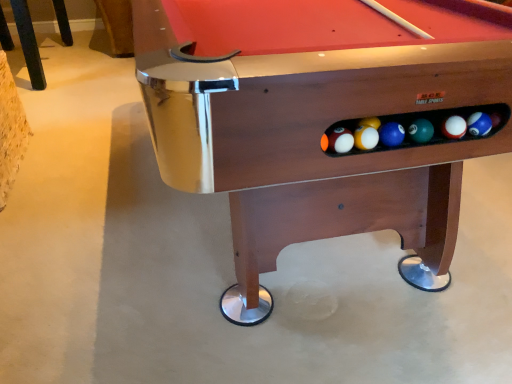
Question: Does wooden chair leg at upper left have a larger size compared to wooden billiard table at center?

Choices:
 (A) yes
 (B) no

Answer: (B)

Question: From the image's perspective, does wooden chair leg at upper left appear lower than wooden billiard table at center?

Choices:
 (A) no
 (B) yes

Answer: (A)

Question: Is wooden chair leg at upper left not inside wooden billiard table at center?

Choices:
 (A) yes
 (B) no

Answer: (A)

Question: Is wooden chair leg at upper left touching wooden billiard table at center?

Choices:
 (A) yes
 (B) no

Answer: (B)

Question: Is wooden chair leg at upper left taller than wooden billiard table at center?

Choices:
 (A) no
 (B) yes

Answer: (A)

Question: From the image's perspective, does wooden chair leg at upper left appear higher than wooden billiard table at center?

Choices:
 (A) no
 (B) yes

Answer: (B)

Question: Is wooden chair leg at upper left at the back of wooden billiard table at center?

Choices:
 (A) no
 (B) yes

Answer: (A)

Question: From a real-world perspective, is wooden billiard table at center on top of wooden chair leg at upper left?

Choices:
 (A) yes
 (B) no

Answer: (A)

Question: Is wooden billiard table at center at the left side of wooden chair leg at upper left?

Choices:
 (A) yes
 (B) no

Answer: (B)

Question: Is wooden billiard table at center completely or partially outside of wooden chair leg at upper left?

Choices:
 (A) no
 (B) yes

Answer: (B)

Question: Does wooden billiard table at center have a lesser width compared to wooden chair leg at upper left?

Choices:
 (A) yes
 (B) no

Answer: (B)

Question: Does wooden billiard table at center have a greater height compared to wooden chair leg at upper left?

Choices:
 (A) yes
 (B) no

Answer: (A)

Question: Do you think wooden chair leg at upper left is within wooden billiard table at center, or outside of it?

Choices:
 (A) outside
 (B) inside

Answer: (A)